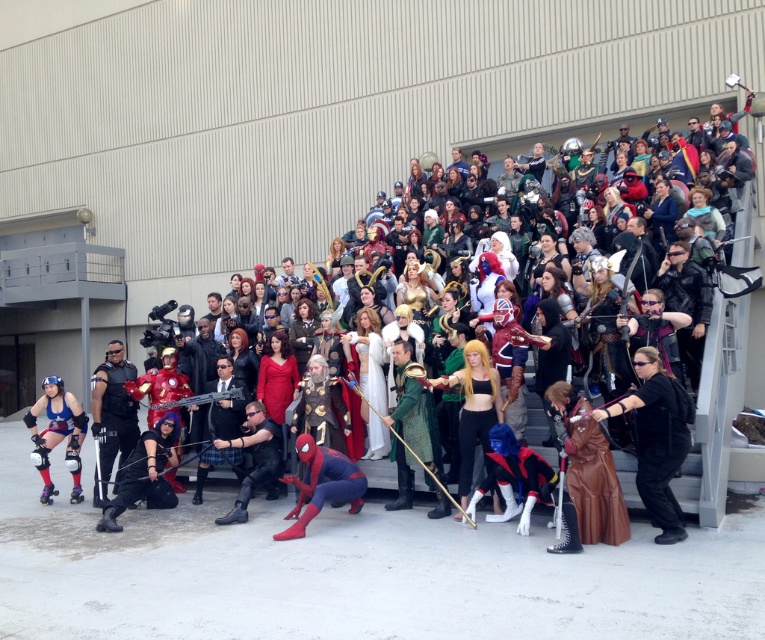
Question: Estimate the real-world distances between objects in this image. Which object is closer to the black matte vest at center?

Choices:
 (A) leather black vest at center
 (B) shiny silver sword at center
 (C) brown leather cape at center-right
 (D) rubberized spandex suit at center

Answer: (A)

Question: In this image, where is rubberized spandex suit at center located relative to leather black vest at center?

Choices:
 (A) below
 (B) above

Answer: (B)

Question: Estimate the real-world distances between objects in this image. Which object is closer to the shiny silver sword at center?

Choices:
 (A) black matte vest at center
 (B) leather black vest at center
 (C) black leather jacket at center

Answer: (B)

Question: Is shiny silver sword at center positioned behind black matte vest at center?

Choices:
 (A) yes
 (B) no

Answer: (B)

Question: Is shiny silver sword at center smaller than black leather jacket at lower right?

Choices:
 (A) no
 (B) yes

Answer: (A)

Question: Which point is closer to the camera?

Choices:
 (A) (116, 436)
 (B) (750, 273)
 (C) (73, 422)
 (D) (285, 516)

Answer: (D)